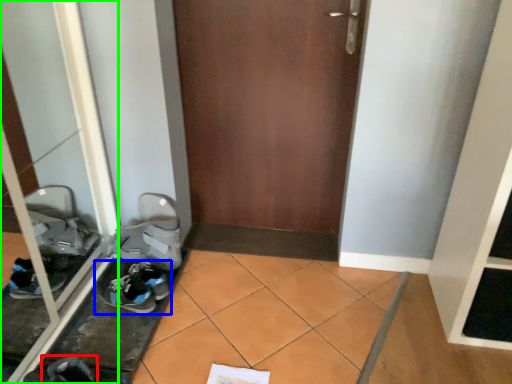
Question: Which object is positioned closest to footwear (highlighted by a red box)? Select from footwear (highlighted by a blue box) and glass door (highlighted by a green box).

Choices:
 (A) footwear
 (B) glass door

Answer: (A)